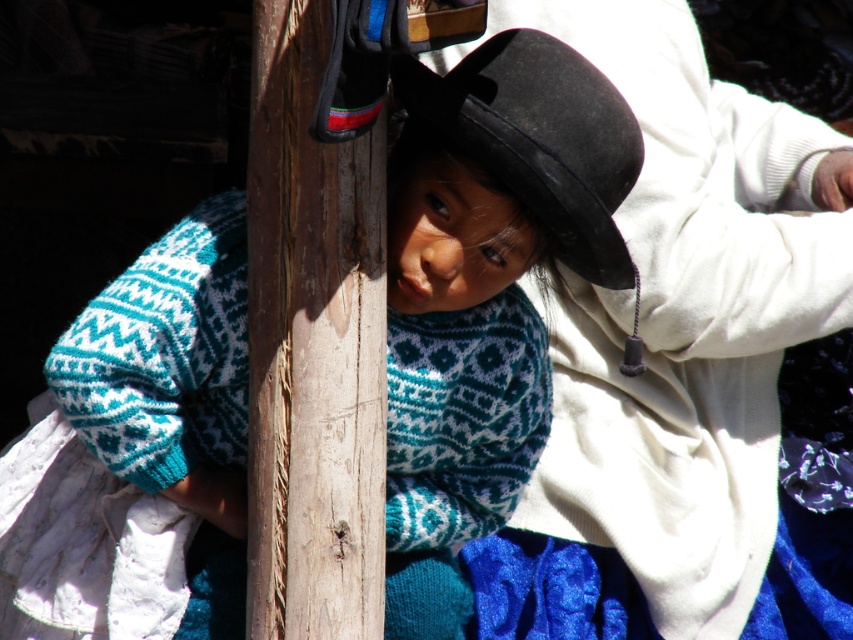
What are the coordinates of the knitted wool sweater at center?

The knitted wool sweater at center is located at coordinates point (485, 291).